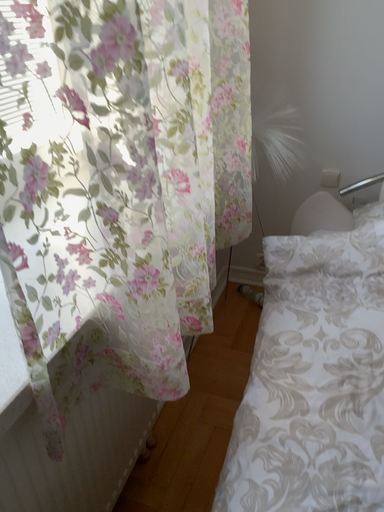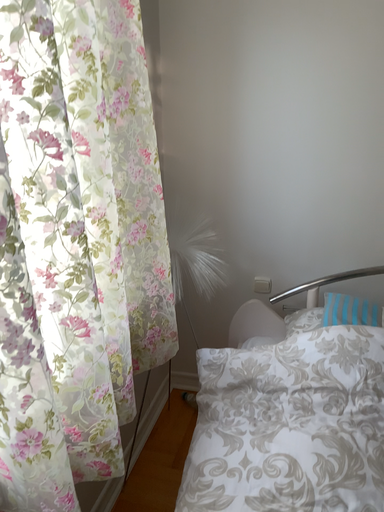
Question: How did the camera likely rotate when shooting the video?

Choices:
 (A) rotated downward
 (B) rotated upward

Answer: (B)